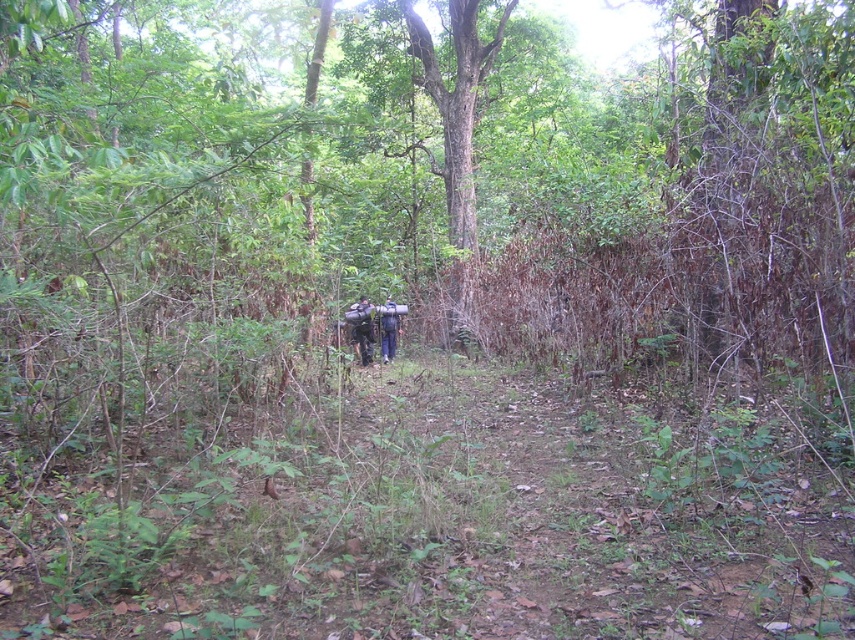
Which of these two, dark green fabric backpack at center or dark blue fabric backpack at center, stands taller?

Standing taller between the two is dark green fabric backpack at center.

Does dark green fabric backpack at center have a larger size compared to dark blue fabric backpack at center?

Correct, dark green fabric backpack at center is larger in size than dark blue fabric backpack at center.

Who is more distant from viewer, [352,317] or [390,323]?

Point [390,323]

What are the coordinates of `dark green fabric backpack at center` in the screenshot? It's located at (363, 328).